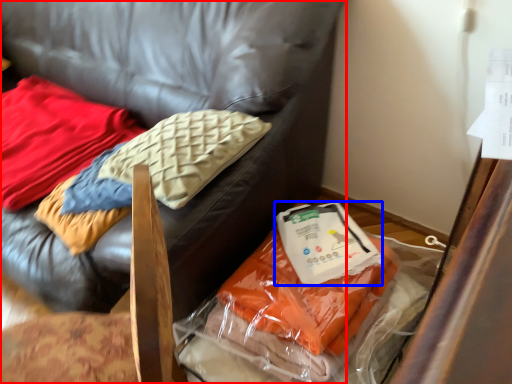
Question: Among these objects, which one is nearest to the camera, furniture (highlighted by a red box) or kit (highlighted by a blue box)?

Choices:
 (A) furniture
 (B) kit

Answer: (A)